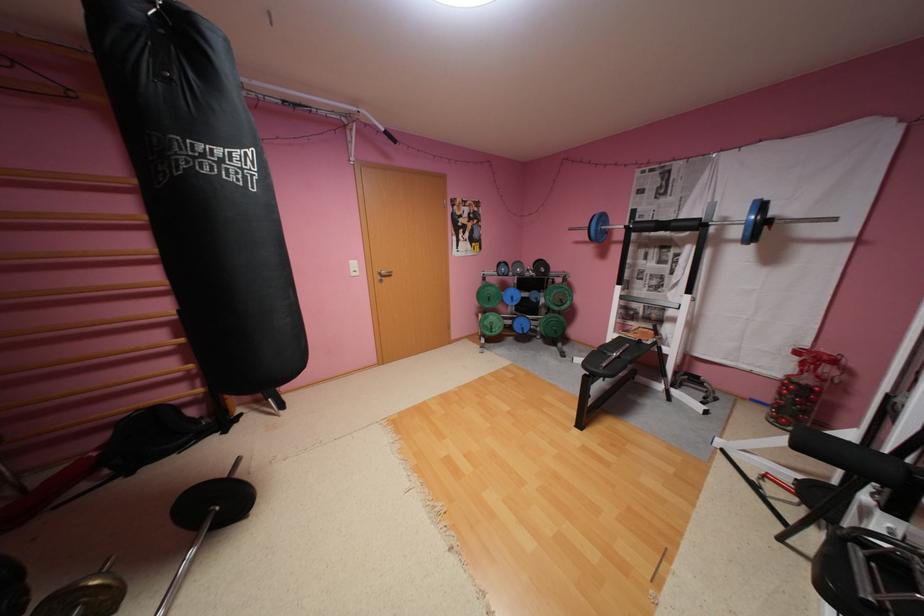
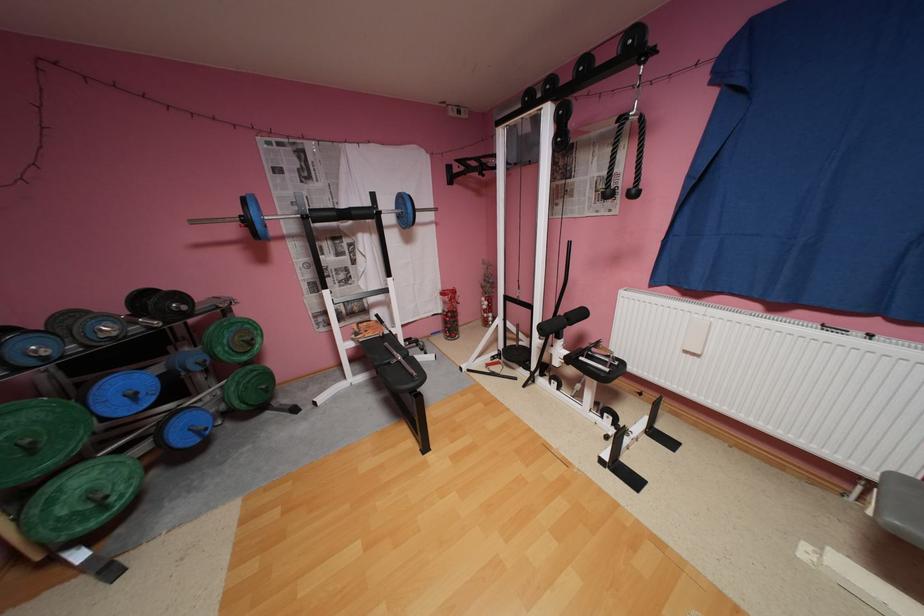
The point at (497, 299) is marked in the first image. Where is the corresponding point in the second image?

(40, 448)